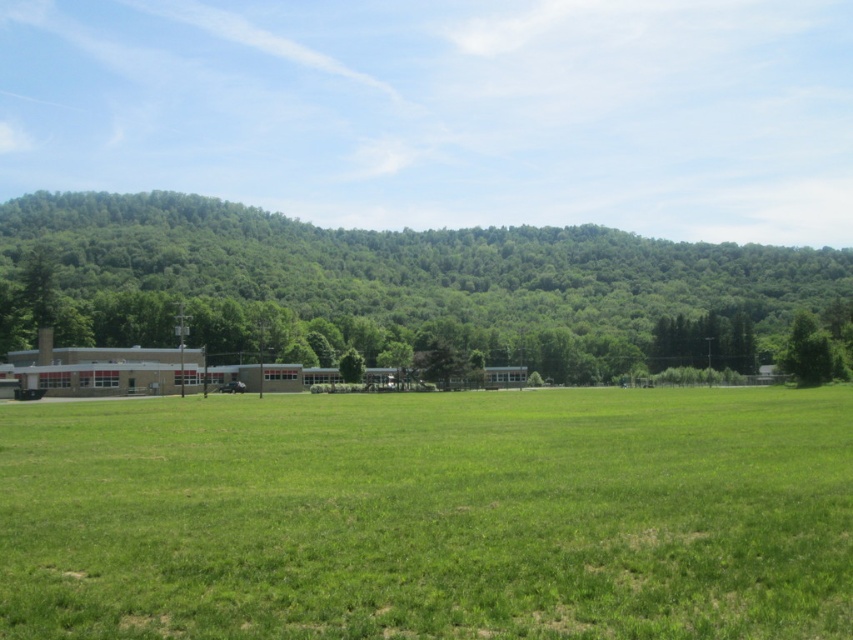
From the picture: You are a gardener who needs to water the green grass at center and the green leafy tree at right. Based on their positions, which one do you think requires more immediate attention? Please explain your reasoning.

The green grass at center is located below the green leafy tree at right, so it might be in the shade and receive less sunlight. This could mean the grass is less likely to dry out quickly compared to the tree, which is exposed to more direct sunlight. Therefore, the green leafy tree at right may require more immediate attention for watering.

You are standing in the middle of the field and want to walk towards the green leafy tree at left. Which direction should you walk to avoid the green grass at center first?

Since the green grass at center is in front of the green leafy tree at left, you should walk to the side of the green grass at center to avoid it first. Walking directly towards the tree would require passing through the grass first.